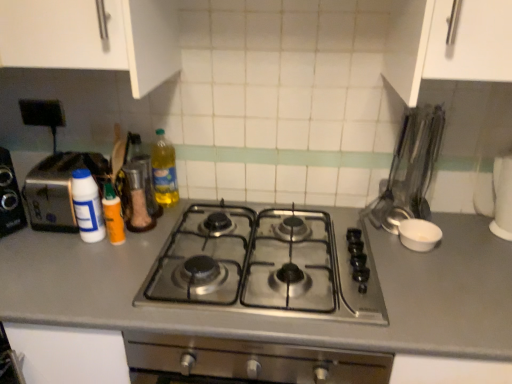
Identify the location of free space in front of white plastic bottle at left, placed as the first bottle when sorted from left to right. (71, 266).